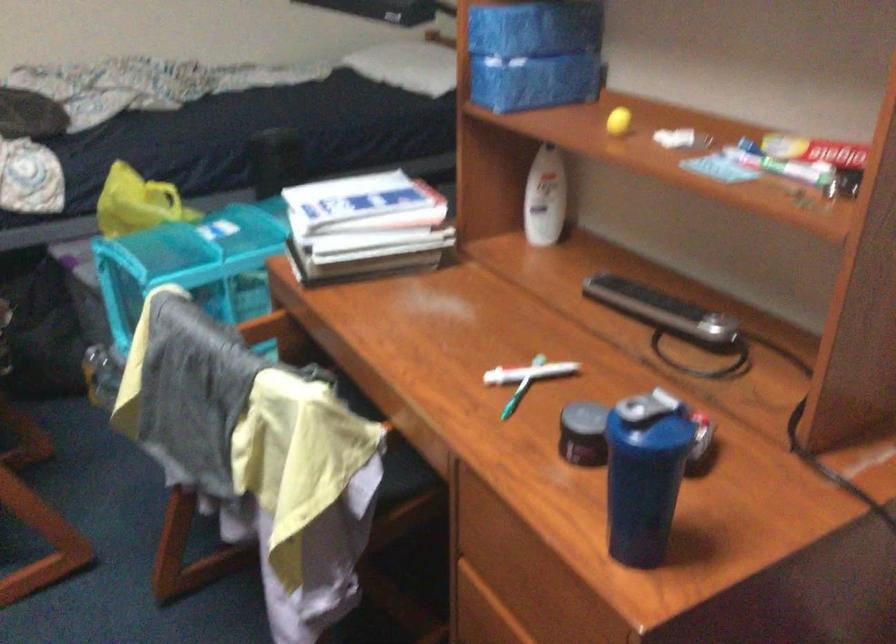
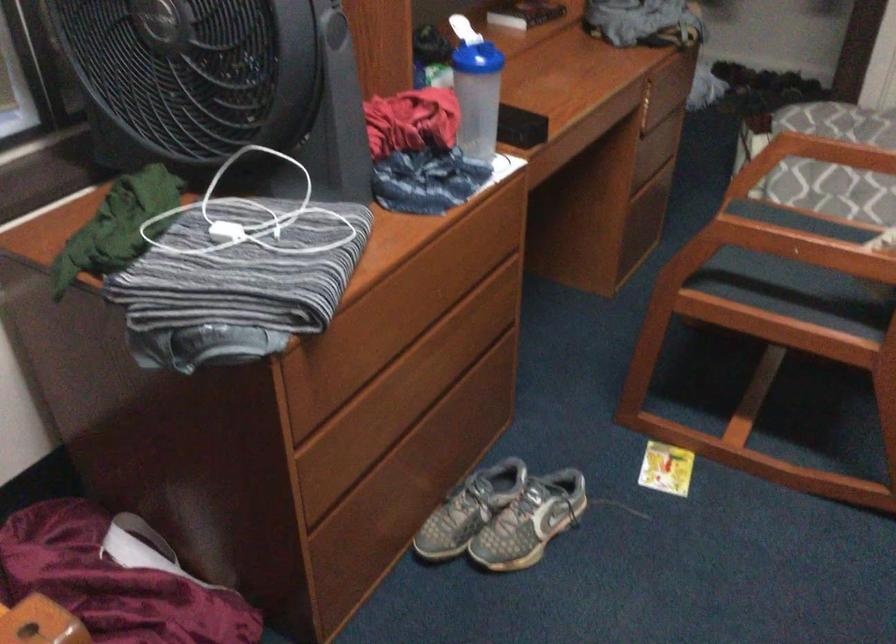
In the scene shown: First-person continuous shooting, in which direction is the camera rotating?

The rotation direction of the camera is left-down.